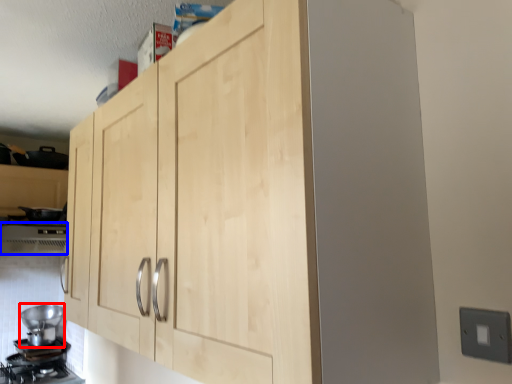
Question: Among these objects, which one is farthest to the camera, appliance (highlighted by a red box) or vent (highlighted by a blue box)?

Choices:
 (A) appliance
 (B) vent

Answer: (A)